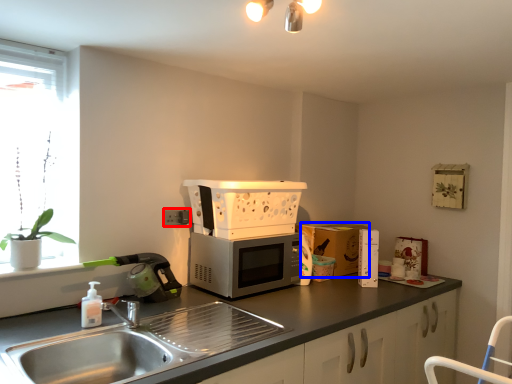
Question: Among these objects, which one is farthest to the camera, electric outlet (highlighted by a red box) or cardboard box (highlighted by a blue box)?

Choices:
 (A) electric outlet
 (B) cardboard box

Answer: (B)